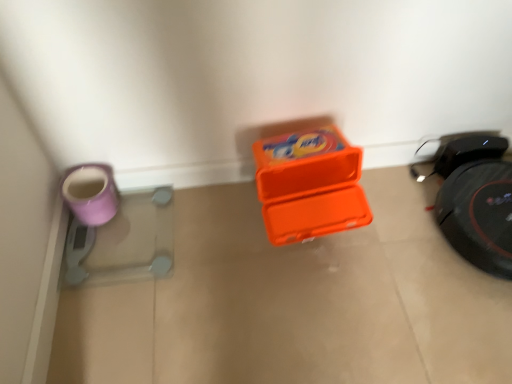
You are a GUI agent. You are given a task and a screenshot of the screen. Output one action in this format:
    pyautogui.click(x=<x>, y=<y>)
    Task: Click on the free space in front of matte purple mug at left
    The image size is (512, 384).
    Given the screenshot: What is the action you would take?
    pyautogui.click(x=103, y=256)